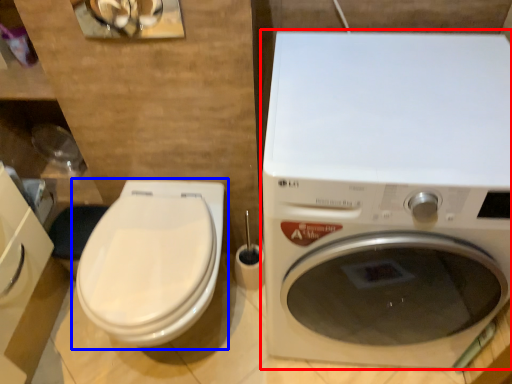
Question: Which object is further to the camera taking this photo, washing machine (highlighted by a red box) or toilet (highlighted by a blue box)?

Choices:
 (A) washing machine
 (B) toilet

Answer: (B)